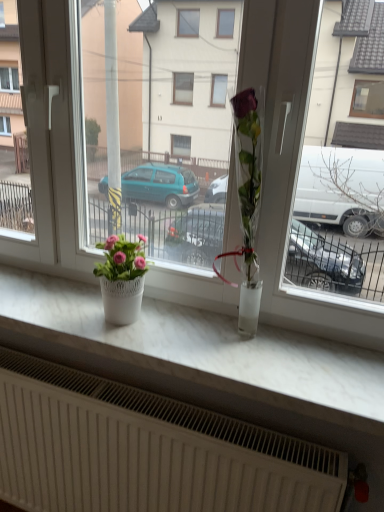
Question: Is white marble counter top at center bigger or smaller than white textured radiator at lower center?

Choices:
 (A) small
 (B) big

Answer: (A)

Question: From a real-world perspective, is white marble counter top at center above or below white textured radiator at lower center?

Choices:
 (A) above
 (B) below

Answer: (A)

Question: Which of these objects is positioned closest to the white marble counter top at center?

Choices:
 (A) white textured radiator at lower center
 (B) transparent glass vase at center
 (C) pink matte flower pot at left

Answer: (C)

Question: Estimate the real-world distances between objects in this image. Which object is closer to the transparent glass vase at center?

Choices:
 (A) pink matte flower pot at left
 (B) white textured radiator at lower center
 (C) white marble counter top at center

Answer: (C)